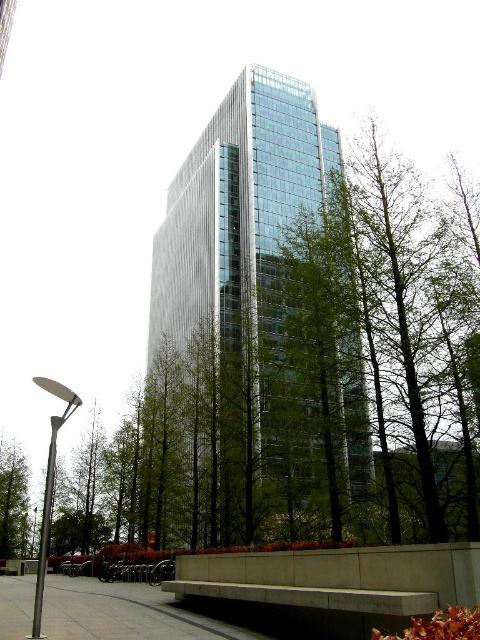
Can you confirm if glassy metallic skyscraper at center is smaller than concrete pavement at lower center?

No.

Which is in front, point (346, 400) or point (108, 621)?

Positioned in front is point (108, 621).

Who is more forward, (x=303, y=196) or (x=55, y=593)?

Point (x=55, y=593) is in front.

Find the location of a particular element. glassy metallic skyscraper at center is located at coordinates (244, 257).

Who is higher up, concrete pavement at lower center or green leafy tree at center?

concrete pavement at lower center

Does concrete pavement at lower center have a lesser width compared to green leafy tree at center?

In fact, concrete pavement at lower center might be wider than green leafy tree at center.

Identify the location of concrete pavement at lower center. Image resolution: width=480 pixels, height=640 pixels. (124, 612).

Can you confirm if glassy metallic skyscraper at center is bigger than green leafy tree at center?

Indeed, glassy metallic skyscraper at center has a larger size compared to green leafy tree at center.

This screenshot has width=480, height=640. Identify the location of glassy metallic skyscraper at center. (244, 257).